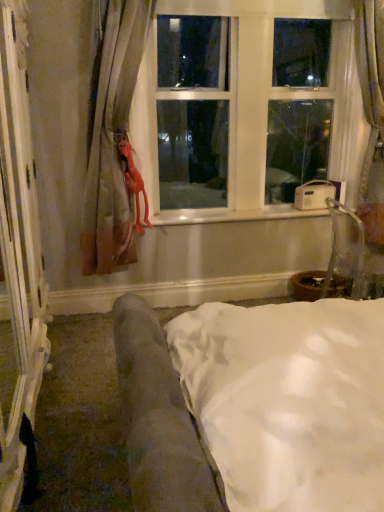
Describe the element at coordinates (255, 405) in the screenshot. I see `velvet fabric couch at lower left` at that location.

What do you see at coordinates (20, 258) in the screenshot? I see `white glossy screen door at left` at bounding box center [20, 258].

You are a GUI agent. You are given a task and a screenshot of the screen. Output one action in this format:
    pyautogui.click(x=<x>, y=<y>)
    Task: Click on the white glossy screen door at left
    This screenshot has width=384, height=512.
    Given the screenshot: What is the action you would take?
    pyautogui.click(x=20, y=258)

What do you see at coordinates (345, 248) in the screenshot? I see `clear plastic armchair at right` at bounding box center [345, 248].

The image size is (384, 512). Describe the element at coordinates (113, 139) in the screenshot. I see `matte beige curtain at left` at that location.

What is the approximate height of rubber orange at left?

23.72 inches.

Where is `velvet fabric couch at lower left`? Image resolution: width=384 pixels, height=512 pixels. velvet fabric couch at lower left is located at coordinates (255, 405).

Would you say white glossy screen door at left contains matte beige curtain at left?

No.

Which is behind, point (24, 305) or point (110, 111)?

Positioned behind is point (110, 111).

Is white glossy screen door at left to the right of matte beige curtain at left from the viewer's perspective?

No.

Between white glossy screen door at left and matte beige curtain at left, which one is positioned in front?

white glossy screen door at left is closer to the camera.

Between rubber orange at left and velvet fabric couch at lower left, which one has smaller size?

rubber orange at left is smaller.

Is point (119, 139) positioned behind point (266, 377)?

Yes, point (119, 139) is farther from viewer.

From a real-world perspective, is rubber orange at left over velvet fabric couch at lower left?

Yes, from a real-world perspective, rubber orange at left is over velvet fabric couch at lower left

Are rubber orange at left and velvet fabric couch at lower left beside each other?

No, rubber orange at left is not next to velvet fabric couch at lower left.

Consider the image. Can you confirm if white plastic window at upper center is smaller than matte beige curtain at left?

No.

How different are the orientations of white plastic window at upper center and matte beige curtain at left in degrees?

The facing directions of white plastic window at upper center and matte beige curtain at left are 0.000626 degrees apart.

Is point (247, 58) less distant than point (129, 169)?

No, (247, 58) is behind (129, 169).

You are a GUI agent. You are given a task and a screenshot of the screen. Output one action in this format:
    pyautogui.click(x=<x>, y=<y>)
    Task: Click on the curtain that is on the left side of white plastic window at upper center
    The height and width of the screenshot is (512, 384).
    Given the screenshot: What is the action you would take?
    pyautogui.click(x=113, y=139)

Considering the sizes of objects velvet fabric couch at lower left and clear plastic armchair at right in the image provided, who is thinner, velvet fabric couch at lower left or clear plastic armchair at right?

With smaller width is clear plastic armchair at right.

From a real-world perspective, between velvet fabric couch at lower left and clear plastic armchair at right, who is vertically higher?

velvet fabric couch at lower left, from a real-world perspective.

Is point (302, 308) positioned after point (350, 244)?

No, (302, 308) is closer to viewer.

Is velvet fabric couch at lower left positioned with its back to clear plastic armchair at right?

velvet fabric couch at lower left does not have its back to clear plastic armchair at right.

Which object is positioned more to the right, matte beige curtain at left or white plastic window at upper center?

white plastic window at upper center.

Considering the relative sizes of matte beige curtain at left and white plastic window at upper center in the image provided, is matte beige curtain at left bigger than white plastic window at upper center?

No.

Does matte beige curtain at left turn towards white plastic window at upper center?

No, matte beige curtain at left is not aimed at white plastic window at upper center.

Is point (102, 206) positioned after point (230, 13)?

No, it is in front of (230, 13).

From a real-world perspective, who is located higher, white plastic window at upper center or rubber orange at left?

white plastic window at upper center is physically above.

Does point (251, 212) lie in front of point (122, 145)?

No.

How different are the orientations of white plastic window at upper center and rubber orange at left in degrees?

They differ by 0.553 degrees in their facing directions.

The height and width of the screenshot is (512, 384). I want to click on doll behind the white plastic window at upper center, so click(x=133, y=180).

Which point is more distant from viewer, (x=17, y=42) or (x=185, y=91)?

The point (x=185, y=91) is farther.

Is white glossy screen door at left oriented towards white plastic window at upper center?

Yes, white glossy screen door at left is oriented towards white plastic window at upper center.

Which is more to the left, white glossy screen door at left or white plastic window at upper center?

white glossy screen door at left.

Can you confirm if white glossy screen door at left is shorter than white plastic window at upper center?

No, white glossy screen door at left is not shorter than white plastic window at upper center.

In order to click on curtain behind the white glossy screen door at left in this screenshot , I will do `click(113, 139)`.

The image size is (384, 512). Find the location of `furniture directly beneath the rubber orange at left (from a real-world perspective)`. furniture directly beneath the rubber orange at left (from a real-world perspective) is located at coordinates (255, 405).

Looking at the image, which one is located closer to velvet fabric couch at lower left, white plastic window at upper center or clear plastic armchair at right?

clear plastic armchair at right lies closer to velvet fabric couch at lower left than the other object.

Which object lies further to the anchor point clear plastic armchair at right, velvet fabric couch at lower left or white glossy screen door at left?

white glossy screen door at left.

Which object lies nearer to the anchor point white glossy screen door at left, clear plastic armchair at right or velvet fabric couch at lower left?

Among the two, velvet fabric couch at lower left is located nearer to white glossy screen door at left.

Looking at this image, looking at the image, which one is located closer to velvet fabric couch at lower left, rubber orange at left or matte beige curtain at left?

The object closer to velvet fabric couch at lower left is matte beige curtain at left.

Which object lies nearer to the anchor point rubber orange at left, velvet fabric couch at lower left or white plastic window at upper center?

white plastic window at upper center.

When comparing their distances from white plastic window at upper center, does velvet fabric couch at lower left or matte beige curtain at left seem further?

The object further to white plastic window at upper center is velvet fabric couch at lower left.

When comparing their distances from rubber orange at left, does white glossy screen door at left or velvet fabric couch at lower left seem closer?

The object closer to rubber orange at left is white glossy screen door at left.

Estimate the real-world distances between objects in this image. Which object is closer to rubber orange at left, matte beige curtain at left or white glossy screen door at left?

matte beige curtain at left lies closer to rubber orange at left than the other object.

The width and height of the screenshot is (384, 512). I want to click on doll between matte beige curtain at left and clear plastic armchair at right from left to right, so click(x=133, y=180).

At what (x,y) coordinates should I click in order to perform the action: click on armchair between velvet fabric couch at lower left and white plastic window at upper center from front to back. Please return your answer as a coordinate pair (x, y). Image resolution: width=384 pixels, height=512 pixels. Looking at the image, I should click on (345, 248).

You are a GUI agent. You are given a task and a screenshot of the screen. Output one action in this format:
    pyautogui.click(x=<x>, y=<y>)
    Task: Click on the curtain located between white glossy screen door at left and clear plastic armchair at right in the depth direction
    This screenshot has height=512, width=384.
    Given the screenshot: What is the action you would take?
    pyautogui.click(x=113, y=139)

Find the location of a particular element. The width and height of the screenshot is (384, 512). window between velvet fabric couch at lower left and rubber orange at left along the z-axis is located at coordinates coord(245,106).